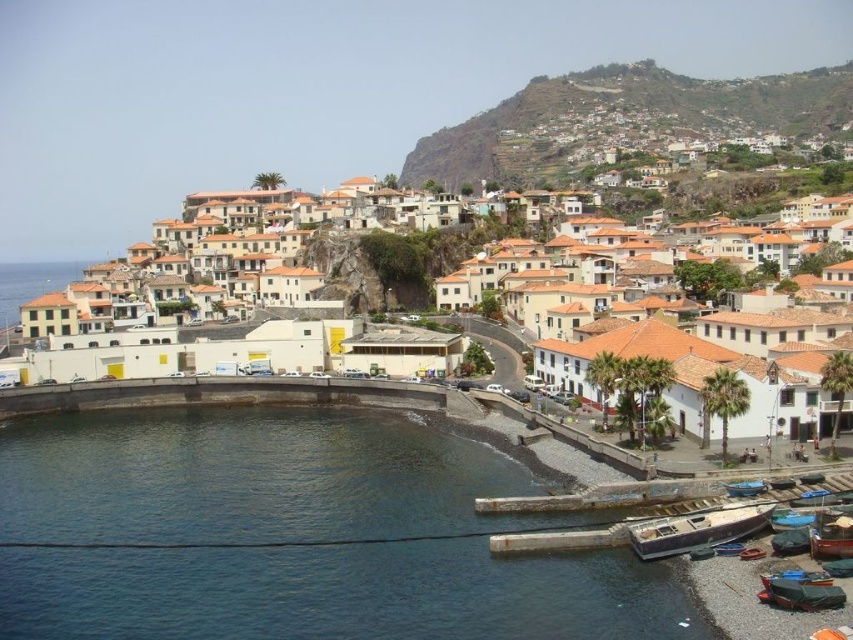
You are a tourist standing at the harbor in the coastal town. You see the white matte building at center. Can you estimate its location relative to the harbor?

The white matte building at center is located at coordinates point (x=648, y=346), which places it centrally in the scene.